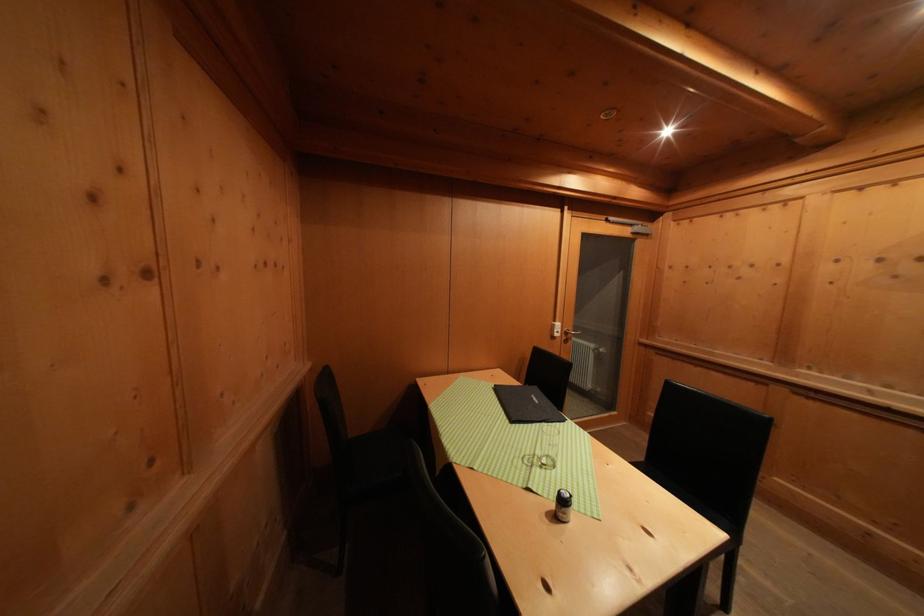
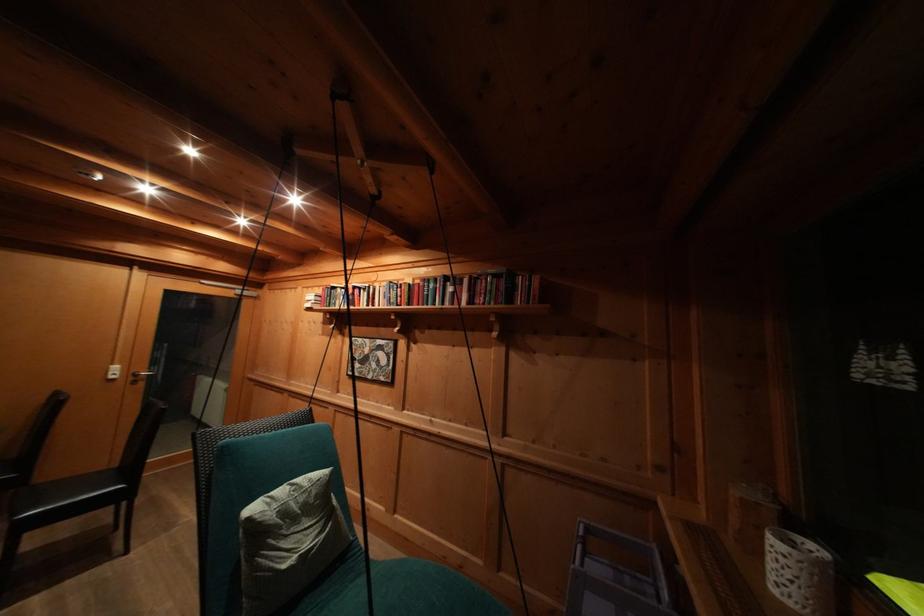
The point at (868,193) is marked in the first image. Where is the corresponding point in the second image?

(313, 293)